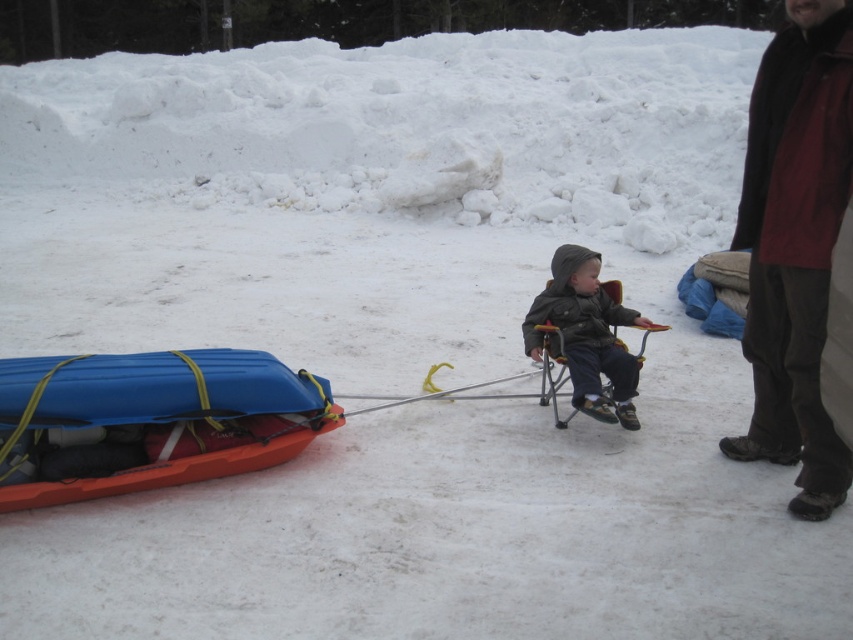
Question: Among these points, which one is farthest from the camera?

Choices:
 (A) (596, 305)
 (B) (42, 444)
 (C) (752, 355)

Answer: (A)

Question: Does blue plastic kayak at lower left have a smaller size compared to dark gray fabric jacket at center?

Choices:
 (A) yes
 (B) no

Answer: (B)

Question: Estimate the real-world distances between objects in this image. Which object is closer to the blue plastic kayak at lower left?

Choices:
 (A) dark gray fabric jacket at center
 (B) dark brown leather jacket at right

Answer: (A)

Question: In this image, where is blue plastic kayak at lower left located relative to dark gray fabric jacket at center?

Choices:
 (A) left
 (B) right

Answer: (A)

Question: Which point is closer to the camera taking this photo?

Choices:
 (A) (606, 355)
 (B) (723, 440)
 (C) (142, 454)

Answer: (C)

Question: Is blue plastic kayak at lower left thinner than dark gray fabric jacket at center?

Choices:
 (A) yes
 (B) no

Answer: (B)